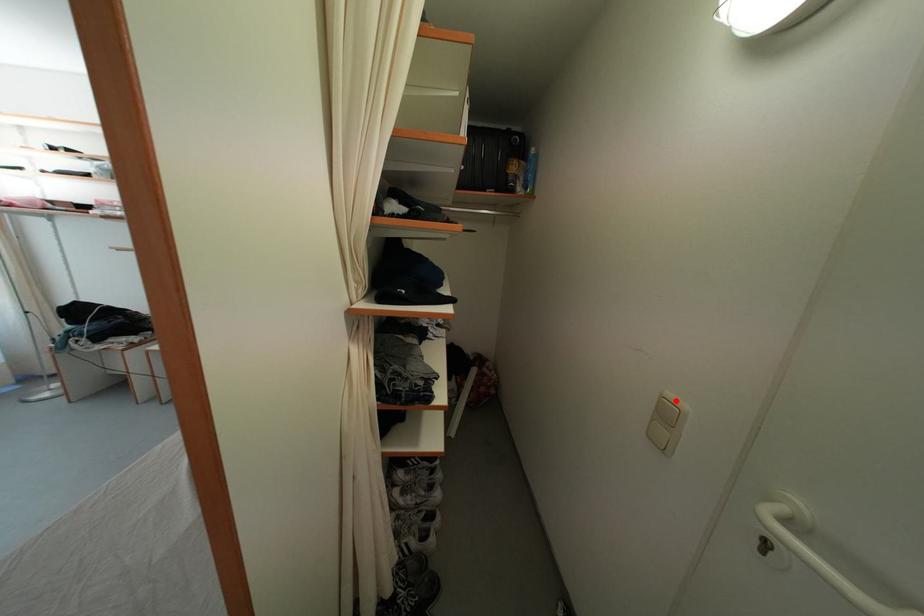
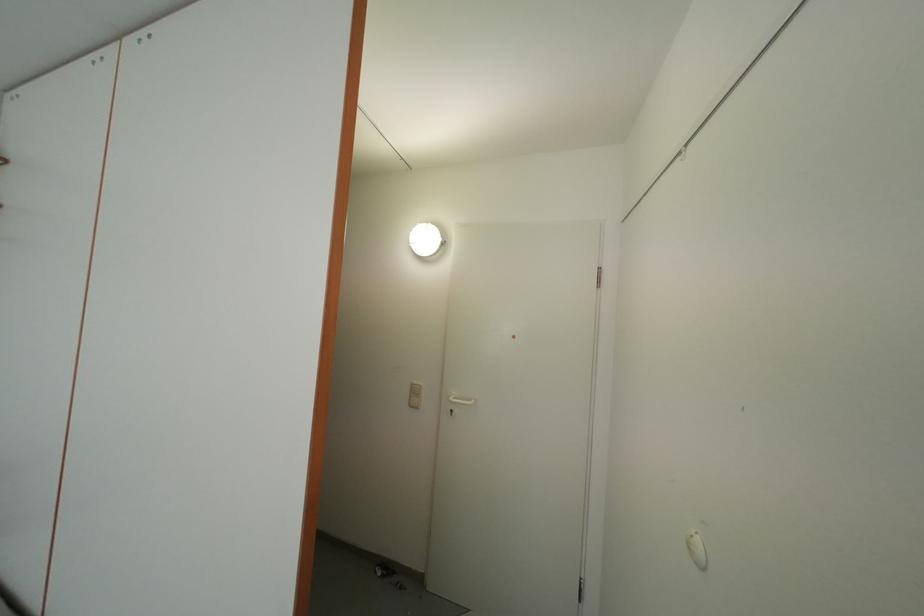
Question: I am providing you with two images of the same scene from different viewpoints. A red point is marked on the first image. Can you still see the location of the red point in image 2?

Choices:
 (A) Yes
 (B) No

Answer: (A)